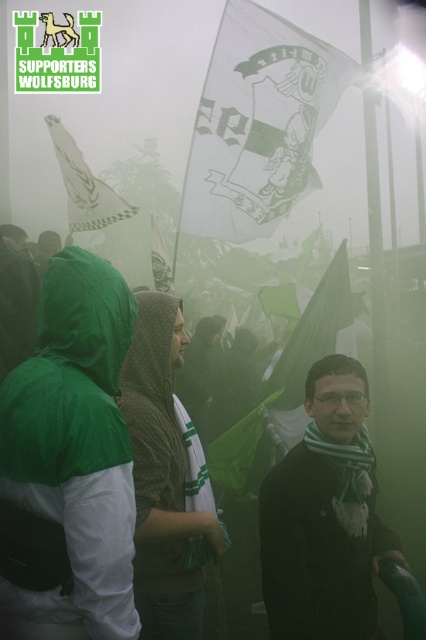
Consider the image. You are a photographer trying to capture a clear shot of the green fabric hood at left and the transparent plastic flag at upper center. Which object is closer to the camera based on their positions?

The green fabric hood at left is positioned under the transparent plastic flag at upper center, meaning the flag is closer to the camera than the hood.

You are a photographer trying to capture a clear photo of the green fabric jacket at center without the transparent plastic flag at upper center blocking it. Is the flag currently blocking the jacket?

The transparent plastic flag at upper center is positioned over green fabric jacket at center, so yes, the flag is currently blocking the jacket.